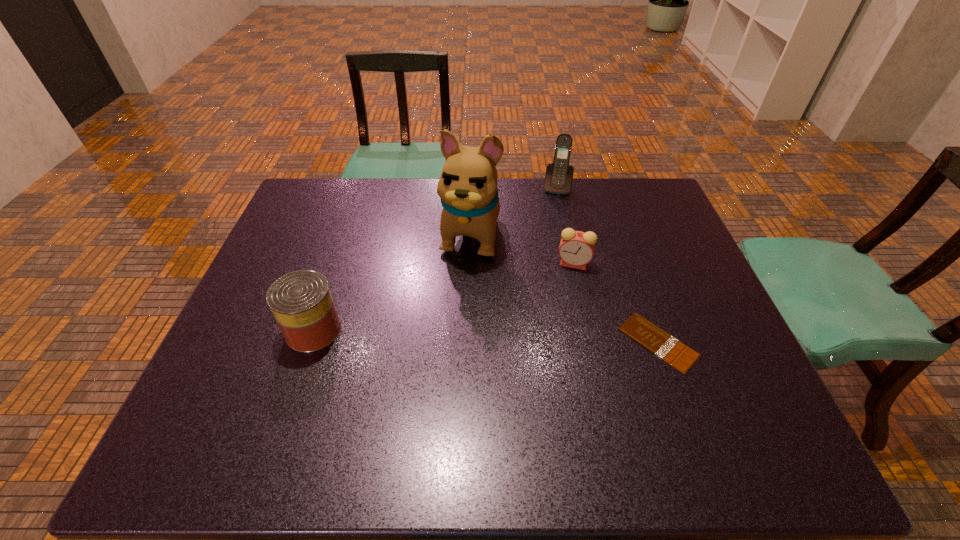
At what (x,y) coordinates should I click in order to perform the action: click on puppy located in the far edge section of the desktop. Please return your answer as a coordinate pair (x, y). Image resolution: width=960 pixels, height=540 pixels. Looking at the image, I should click on (467, 187).

The width and height of the screenshot is (960, 540). Identify the location of cellular telephone at the far edge. (558, 179).

At what (x,y) coordinates should I click in order to perform the action: click on object located in the left edge section of the desktop. Please return your answer as a coordinate pair (x, y). Looking at the image, I should click on (301, 302).

Find the location of a particular element. The image size is (960, 540). object that is at the right edge is located at coordinates (656, 340).

Find the location of `vacant region at the far edge of the desktop`. vacant region at the far edge of the desktop is located at coordinates (388, 208).

The width and height of the screenshot is (960, 540). In order to click on vacant space at the near edge in this screenshot , I will do `click(543, 402)`.

This screenshot has height=540, width=960. In the image, there is a desktop. What are the coordinates of `vacant space at the right edge` in the screenshot? It's located at (678, 289).

In the image, there is a desktop. Where is `vacant space at the near left corner`? The width and height of the screenshot is (960, 540). vacant space at the near left corner is located at coordinates (232, 384).

Where is `vacant space at the far right corner of the desktop`? The image size is (960, 540). vacant space at the far right corner of the desktop is located at coordinates (640, 206).

Where is `free area in between the shortest object and the second shortest object`? The height and width of the screenshot is (540, 960). free area in between the shortest object and the second shortest object is located at coordinates (615, 303).